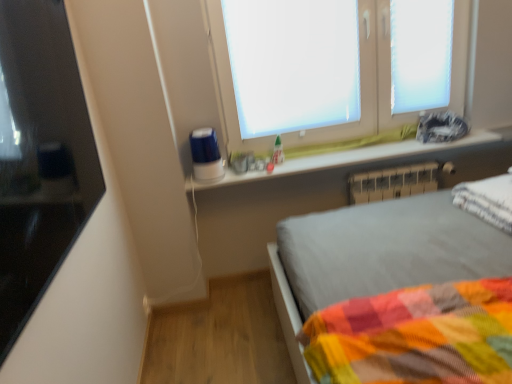
Question: Is white plastic radiator at lower right bigger or smaller than white matte window screen at upper center?

Choices:
 (A) small
 (B) big

Answer: (A)

Question: From a real-world perspective, is white plastic radiator at lower right physically located above or below white matte window screen at upper center?

Choices:
 (A) above
 (B) below

Answer: (B)

Question: Which object is the closest to the white frosted glass window at upper center?

Choices:
 (A) white matte window screen at upper center
 (B) black glossy monitor at left
 (C) white glossy window sill at upper center
 (D) white plastic window frame at upper right
 (E) white soft pillow at right

Answer: (A)

Question: Estimate the real-world distances between objects in this image. Which object is closer to the white plastic radiator at lower right?

Choices:
 (A) white frosted glass window at upper center
 (B) white plastic window frame at upper right
 (C) white glossy window sill at upper center
 (D) black glossy monitor at left
 (E) white soft pillow at right

Answer: (C)